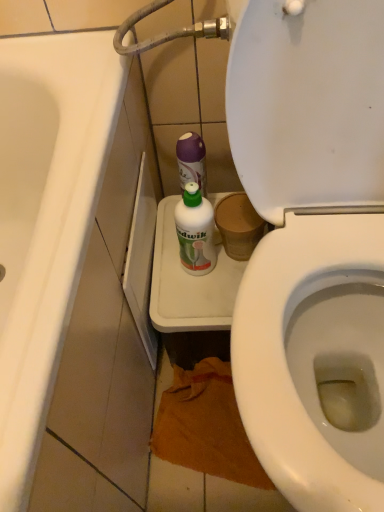
Measure the distance between white plastic bottle at center and camera.

27.53 inches.

Image resolution: width=384 pixels, height=512 pixels. Find the location of `white plastic bottle at center`. white plastic bottle at center is located at coordinates (195, 231).

What is the approximate width of white plastic bottle at center?

white plastic bottle at center is 2.71 inches wide.

Describe the element at coordinates (195, 231) in the screenshot. I see `white plastic bottle at center` at that location.

Measure the distance between point (189, 183) and camera.

Point (189, 183) is 28.54 inches from camera.

What is the approximate width of white glossy bathtub at left?

It is 49.38 centimeters.

What is the approximate height of white glossy bathtub at left?

It is 22.37 inches.

This screenshot has height=512, width=384. I want to click on white glossy bathtub at left, so click(x=46, y=219).

What do you see at coordinates (46, 219) in the screenshot?
I see `white glossy bathtub at left` at bounding box center [46, 219].

Where is `white plastic bottle at center`? This screenshot has width=384, height=512. white plastic bottle at center is located at coordinates (195, 231).

Does white glossy bathtub at left appear on the left side of white plastic bottle at center?

Indeed, white glossy bathtub at left is positioned on the left side of white plastic bottle at center.

Based on the photo, does white glossy bathtub at left come behind white plastic bottle at center?

That is False.

Considering the positions of points (71, 37) and (209, 211), is point (71, 37) closer to camera compared to point (209, 211)?

No, it is not.

Based on the photo, from the image's perspective, which object appears higher, white glossy bathtub at left or white plastic bottle at center?

white plastic bottle at center is shown above in the image.

From a real-world perspective, is white glossy bathtub at left above or below white plastic bottle at center?

white glossy bathtub at left is situated lower than white plastic bottle at center in the real world.

Can you confirm if white glossy bathtub at left is thinner than white plastic bottle at center?

No.

Considering the relative sizes of white glossy bathtub at left and white plastic bottle at center in the image provided, is white glossy bathtub at left shorter than white plastic bottle at center?

In fact, white glossy bathtub at left may be taller than white plastic bottle at center.

Which of these two, white glossy bathtub at left or white plastic bottle at center, is bigger?

Bigger between the two is white glossy bathtub at left.

Is white glossy bathtub at left inside or outside of white plastic bottle at center?

The correct answer is: outside.

Consider the image. Is white glossy bathtub at left touching white plastic bottle at center?

No, white glossy bathtub at left is not beside white plastic bottle at center.

Could you tell me if white glossy bathtub at left is facing white plastic bottle at center?

Yes, white glossy bathtub at left is facing white plastic bottle at center.

How many degrees apart are the facing directions of white glossy bathtub at left and white plastic bottle at center?

white glossy bathtub at left and white plastic bottle at center are facing 90 degrees away from each other.

Measure the distance from white glossy bathtub at left to white plastic bottle at center.

10.38 inches.

At what (x,y) coordinates should I click in order to perform the action: click on cleaning product that appears on the right of white glossy bathtub at left. Please return your answer as a coordinate pair (x, y). Looking at the image, I should click on (195, 231).

Looking at this image, considering the positions of objects white plastic bottle at center and white glossy bathtub at left in the image provided, who is more to the right, white plastic bottle at center or white glossy bathtub at left?

From the viewer's perspective, white plastic bottle at center appears more on the right side.

Looking at this image, in the image, is white plastic bottle at center positioned in front of or behind white glossy bathtub at left?

white plastic bottle at center is behind white glossy bathtub at left.

Does point (193, 245) appear closer or farther from the camera than point (32, 156)?

Clearly, point (193, 245) is closer to the camera than point (32, 156).

From the image's perspective, between white plastic bottle at center and white glossy bathtub at left, which one is located above?

white plastic bottle at center is shown above in the image.

From a real-world perspective, is white plastic bottle at center physically located above or below white glossy bathtub at left?

white plastic bottle at center is above white glossy bathtub at left.

Between white plastic bottle at center and white glossy bathtub at left, which one has larger width?

white glossy bathtub at left is wider.

Does white plastic bottle at center have a greater height compared to white glossy bathtub at left?

In fact, white plastic bottle at center may be shorter than white glossy bathtub at left.

Is white plastic bottle at center bigger than white glossy bathtub at left?

No.

Is white plastic bottle at center not within white glossy bathtub at left?

Yes, white plastic bottle at center is not within white glossy bathtub at left.

Is white plastic bottle at center not near white glossy bathtub at left?

Actually, white plastic bottle at center and white glossy bathtub at left are a little close together.

Is white glossy bathtub at left at the back of white plastic bottle at center?

No, white glossy bathtub at left is not at the back of white plastic bottle at center.

Looking at this image, how many degrees apart are the facing directions of white plastic bottle at center and white glossy bathtub at left?

The angular difference between white plastic bottle at center and white glossy bathtub at left is 90 degrees.

Identify the location of bath located on the left of white plastic bottle at center. (46, 219).

Image resolution: width=384 pixels, height=512 pixels. What are the coordinates of `bath located on the left of white plastic bottle at center` in the screenshot? It's located at (46, 219).

You are a GUI agent. You are given a task and a screenshot of the screen. Output one action in this format:
    pyautogui.click(x=<x>, y=<y>)
    Task: Click on the cleaning product that appears above the white glossy bathtub at left (from the image's perspective)
    This screenshot has width=384, height=512.
    Given the screenshot: What is the action you would take?
    pyautogui.click(x=195, y=231)